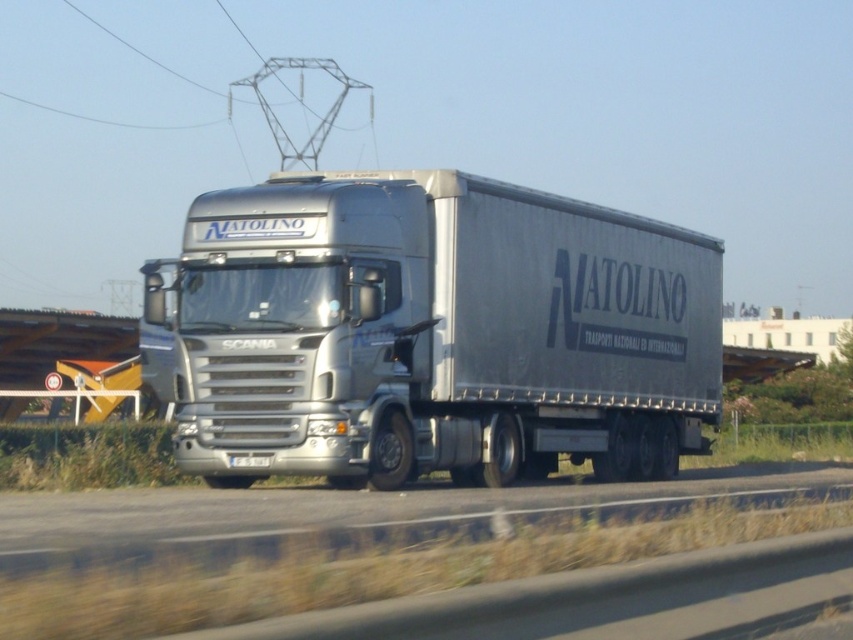
You are a delivery driver who needs to park the silver metallic trailer truck at center precisely on the gray asphalt road at center. Given that the truck is currently 2.25 meters away from the road, how much distance do you need to adjust to align it correctly?

The silver metallic trailer truck at center is currently 2.25 meters away from the gray asphalt road at center, so you need to move it 2.25 meters closer to the road to align it properly.

You are a photographer trying to capture the silver metallic trailer truck at center and the gray asphalt road at center in a single shot. Which object should you focus on first if you want to ensure both are in frame and the truck is not too small compared to the road?

The silver metallic trailer truck at center is smaller than the gray asphalt road at center, so you should focus on the truck first to ensure it is properly framed and not too small compared to the road.

You are a delivery driver planning to drive your truck through a narrow tunnel. The tunnel has a width restriction that only allows vehicles narrower than the gray asphalt road at center. Based on the image, can your silver metallic trailer truck at center fit through the tunnel?

The silver metallic trailer truck at center has a lesser width compared to the gray asphalt road at center, so it can fit through the tunnel since the truck is narrower than the road which the tunnel allows.